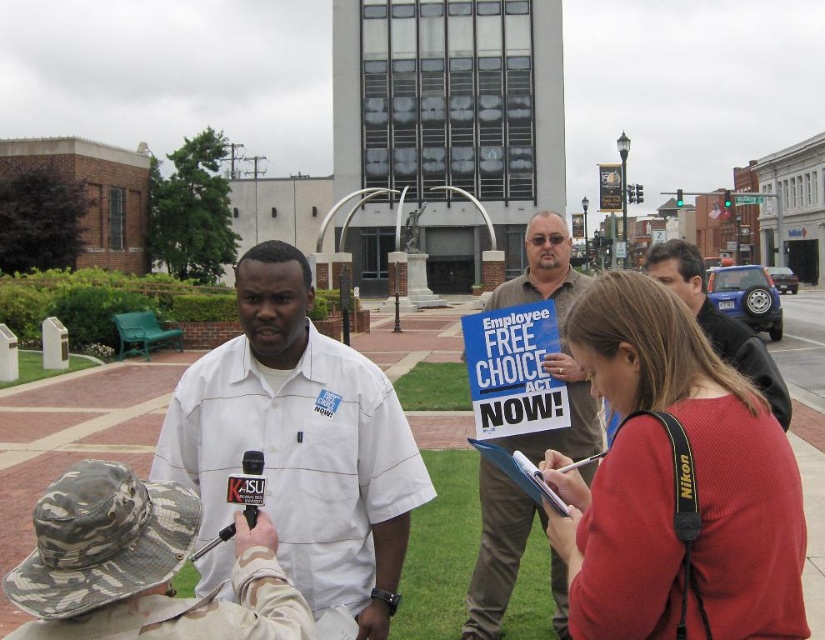
Between red knit sweater at center and white cotton shirt at center, which one appears on the left side from the viewer's perspective?

From the viewer's perspective, white cotton shirt at center appears more on the left side.

Is point (644, 488) behind point (215, 531)?

No, (644, 488) is closer to viewer.

Who is more distant from viewer, (739, 500) or (272, 356)?

Point (272, 356)

Find the location of a particular element. red knit sweater at center is located at coordinates (672, 480).

Is point (376, 417) behind point (550, 372)?

No, (376, 417) is in front of (550, 372).

Is white cotton shirt at center positioned behind brown paper bag at center?

No, it is not.

Does point (305, 531) lie behind point (475, 566)?

That is False.

This screenshot has height=640, width=825. I want to click on white cotton shirt at center, so click(x=300, y=442).

Is red knit sweater at center taller than dark brown leather jacket at center?

Yes, red knit sweater at center is taller than dark brown leather jacket at center.

Can you confirm if red knit sweater at center is shorter than dark brown leather jacket at center?

No, red knit sweater at center is not shorter than dark brown leather jacket at center.

Consider the image. Who is more forward, (743,488) or (765,364)?

Point (743,488) is in front.

Identify the location of red knit sweater at center. (672, 480).